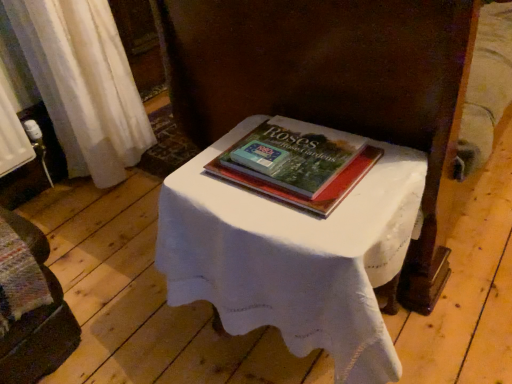
Where is `hardcover book at center`? Image resolution: width=512 pixels, height=384 pixels. hardcover book at center is located at coordinates tap(298, 163).

Find the location of a particular element. The height and width of the screenshot is (384, 512). hardcover book at center is located at coordinates (298, 163).

From a real-world perspective, is hardcover book at center over white cloth-covered table at center?

Yes, from a real-world perspective, hardcover book at center is on top of white cloth-covered table at center.

From the image's perspective, which is above, hardcover book at center or white cloth-covered table at center?

hardcover book at center, from the image's perspective.

In terms of height, does hardcover book at center look taller or shorter compared to white cloth-covered table at center?

Considering their sizes, hardcover book at center has less height than white cloth-covered table at center.

In terms of width, does hardcover book at center look wider or thinner when compared to white cloth-covered table at center?

Considering their sizes, hardcover book at center looks slimmer than white cloth-covered table at center.

Is wooden bench at lower left smaller than white cloth-covered table at center?

Correct, wooden bench at lower left occupies less space than white cloth-covered table at center.

This screenshot has width=512, height=384. In order to click on furniture below the white cloth-covered table at center (from the image's perspective) in this screenshot , I will do `click(30, 306)`.

From the image's perspective, is wooden bench at lower left located above or below white cloth-covered table at center?

From the image's perspective, wooden bench at lower left appears below white cloth-covered table at center.

Which object is thinner, wooden bench at lower left or white cloth-covered table at center?

With smaller width is white cloth-covered table at center.

Considering the sizes of objects white cloth-covered table at center and hardcover book at center in the image provided, who is taller, white cloth-covered table at center or hardcover book at center?

Standing taller between the two is white cloth-covered table at center.

From a real-world perspective, between white cloth-covered table at center and hardcover book at center, who is vertically lower?

From a 3D spatial view, white cloth-covered table at center is below.

Identify the location of table below the hardcover book at center (from the image's perspective). (293, 257).

Could you tell me if hardcover book at center is turned towards wooden bench at lower left?

No, hardcover book at center does not turn towards wooden bench at lower left.

Is hardcover book at center not close to wooden bench at lower left?

They are positioned close to each other.

Between point (252, 143) and point (20, 375), which one is positioned in front?

The point (252, 143) is closer.

From a real-world perspective, is hardcover book at center on wooden bench at lower left?

Indeed, from a real-world perspective, hardcover book at center stands above wooden bench at lower left.

Identify the location of furniture below the white cloth-covered table at center (from a real-world perspective). This screenshot has width=512, height=384. (30, 306).

Between point (369, 375) and point (1, 354), which one is positioned in front?

Positioned in front is point (369, 375).

From a real-world perspective, which is physically above, white cloth-covered table at center or wooden bench at lower left?

white cloth-covered table at center, from a real-world perspective.

Is white cloth-covered table at center smaller than wooden bench at lower left?

Actually, white cloth-covered table at center might be larger than wooden bench at lower left.

Considering the positions of objects wooden bench at lower left and hardcover book at center in the image provided, who is more to the left, wooden bench at lower left or hardcover book at center?

wooden bench at lower left.

Looking at the image, does wooden bench at lower left seem bigger or smaller compared to hardcover book at center?

Considering their sizes, wooden bench at lower left takes up more space than hardcover book at center.

Does point (11, 275) come closer to viewer compared to point (283, 160)?

No, it is behind (283, 160).

Where is `furniture beneath the hardcover book at center (from a real-world perspective)`? The height and width of the screenshot is (384, 512). furniture beneath the hardcover book at center (from a real-world perspective) is located at coordinates (30, 306).

The image size is (512, 384). Identify the location of book located on the left of white cloth-covered table at center. (298, 163).

Find the location of a particular element. The height and width of the screenshot is (384, 512). furniture that is under the white cloth-covered table at center (from a real-world perspective) is located at coordinates (30, 306).

Looking at the image, which one is located closer to white cloth-covered table at center, wooden bench at lower left or hardcover book at center?

The object closer to white cloth-covered table at center is hardcover book at center.

Considering their positions, is wooden bench at lower left positioned further to hardcover book at center than white cloth-covered table at center?

Among the two, wooden bench at lower left is located further to hardcover book at center.

Looking at the image, which one is located closer to hardcover book at center, white cloth-covered table at center or wooden bench at lower left?

white cloth-covered table at center is closer to hardcover book at center.

Looking at the image, which one is located further to white cloth-covered table at center, hardcover book at center or wooden bench at lower left?

Among the two, wooden bench at lower left is located further to white cloth-covered table at center.

Which object lies nearer to the anchor point wooden bench at lower left, hardcover book at center or white cloth-covered table at center?

white cloth-covered table at center is closer to wooden bench at lower left.

Looking at the image, which one is located further to wooden bench at lower left, white cloth-covered table at center or hardcover book at center?

Based on the image, hardcover book at center appears to be further to wooden bench at lower left.

Locate an element on the screen. This screenshot has width=512, height=384. book located between wooden bench at lower left and white cloth-covered table at center in the left-right direction is located at coordinates (298, 163).